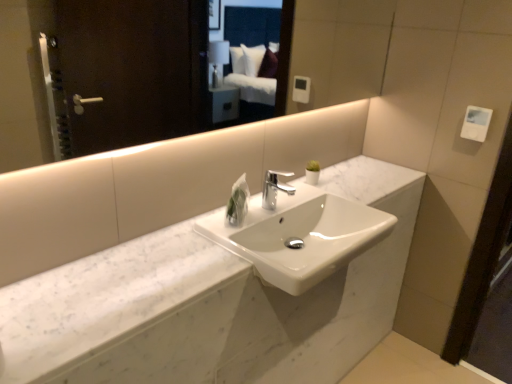
Identify the location of free point behind polished chrome faucet at center. This screenshot has height=384, width=512. (282, 191).